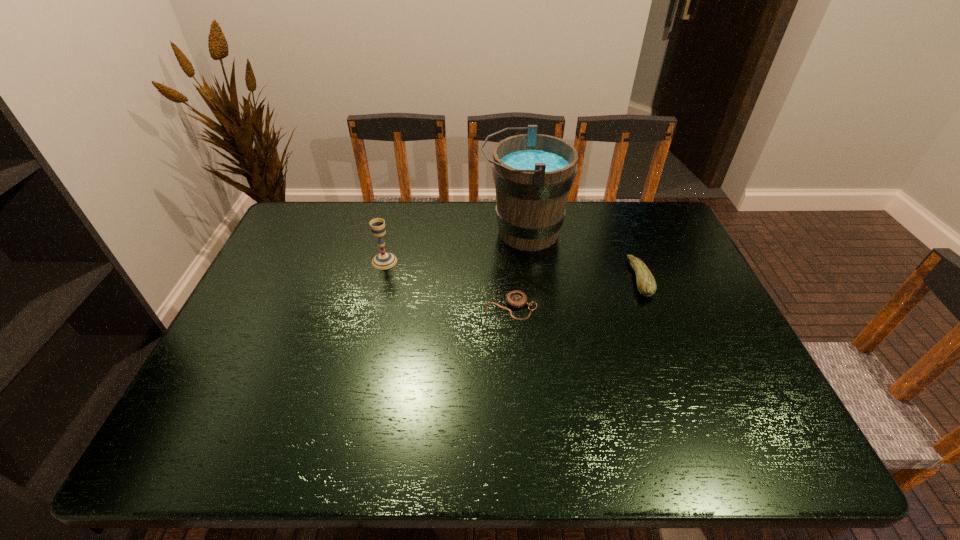
Locate an element on the screen. This screenshot has height=540, width=960. free spot between the third shortest object and the shortest object is located at coordinates (447, 284).

Find the location of a particular element. This screenshot has width=960, height=540. object that can be found as the second closest to the zucchini is located at coordinates (x=516, y=299).

Identify which object is the second nearest to the shortest object. Please provide its 2D coordinates. Your answer should be formatted as a tuple, i.e. [(x, y)], where the tuple contains the x and y coordinates of a point satisfying the conditions above.

[(646, 284)]

Identify the location of vacant space that satisfies the following two spatial constraints: 1. with a handle on the side of the tallest object; 2. on the front side of the chalice. The width and height of the screenshot is (960, 540). (527, 261).

Locate an element on the screen. The image size is (960, 540). free location that satisfies the following two spatial constraints: 1. with a handle on the side of the tallest object; 2. on the front side of the chalice is located at coordinates (527, 261).